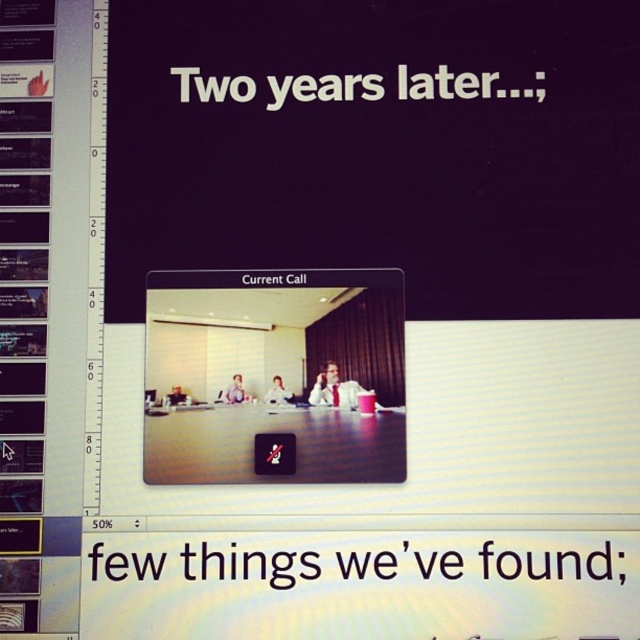
Question: Among these objects, which one is nearest to the camera?

Choices:
 (A) black plastic text at center
 (B) matte black screen at center

Answer: (A)

Question: Which point is closer to the camera?

Choices:
 (A) (502, 570)
 (B) (152, 285)

Answer: (A)

Question: Considering the relative positions of matte black screen at center and black plastic text at center in the image provided, where is matte black screen at center located with respect to black plastic text at center?

Choices:
 (A) left
 (B) right

Answer: (A)

Question: Can you confirm if matte black screen at center is positioned above black plastic text at center?

Choices:
 (A) no
 (B) yes

Answer: (B)

Question: Which of the following is the closest to the observer?

Choices:
 (A) matte black screen at center
 (B) black plastic text at center

Answer: (B)

Question: Does matte black screen at center appear under black plastic text at center?

Choices:
 (A) yes
 (B) no

Answer: (B)